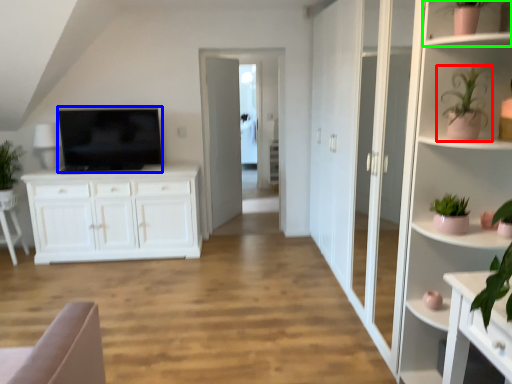
Question: Which object is positioned closest to houseplant (highlighted by a red box)? Select from television (highlighted by a blue box) and shelf (highlighted by a green box).

Choices:
 (A) television
 (B) shelf

Answer: (B)